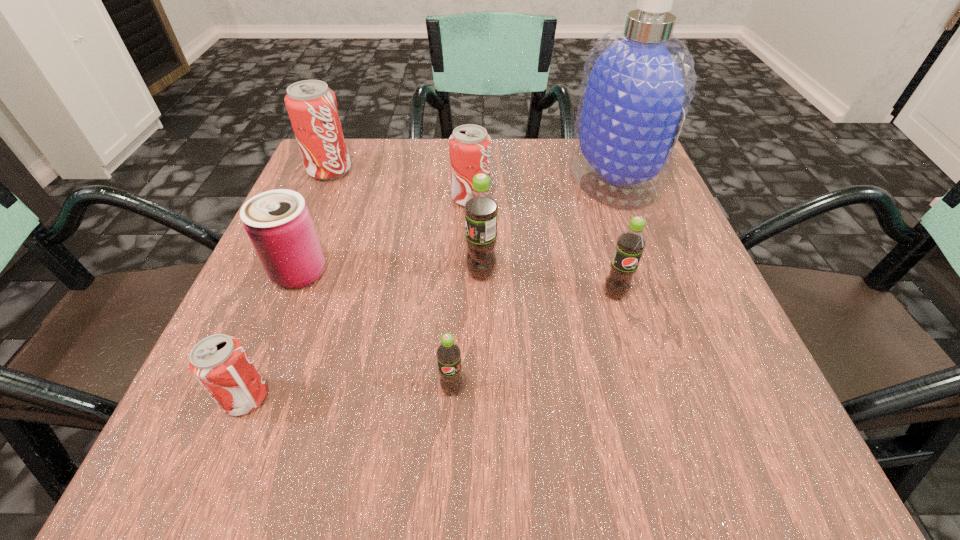
In the image, there is a desktop. Where is `vacant space at the near edge`? The image size is (960, 540). vacant space at the near edge is located at coordinates (543, 420).

What are the coordinates of `free spot at the left edge of the desktop` in the screenshot? It's located at (329, 289).

The width and height of the screenshot is (960, 540). I want to click on free spot at the right edge of the desktop, so [x=643, y=303].

Image resolution: width=960 pixels, height=540 pixels. Find the location of `vacant space at the far left corner`. vacant space at the far left corner is located at coordinates (358, 163).

You are a GUI agent. You are given a task and a screenshot of the screen. Output one action in this format:
    pyautogui.click(x=<x>, y=<y>)
    Task: Click on the vacant space at the near left corner
    Image resolution: width=960 pixels, height=540 pixels.
    Given the screenshot: What is the action you would take?
    pyautogui.click(x=242, y=437)

I want to click on free location at the near right corner, so click(x=687, y=417).

The height and width of the screenshot is (540, 960). In order to click on free spot between the tallest object and the biggest green soda in this screenshot , I will do `click(546, 226)`.

The width and height of the screenshot is (960, 540). In order to click on vacant area that lies between the smallest pink soda can and the second smallest pink soda can in this screenshot , I will do `click(358, 298)`.

At what (x,y) coordinates should I click in order to perform the action: click on vacant point located between the second farthest soda and the smallest green soda. Please return your answer as a coordinate pair (x, y). Image resolution: width=960 pixels, height=540 pixels. Looking at the image, I should click on (462, 293).

Locate an element on the screen. vacant space in between the second farthest pink soda can and the pink can is located at coordinates (385, 235).